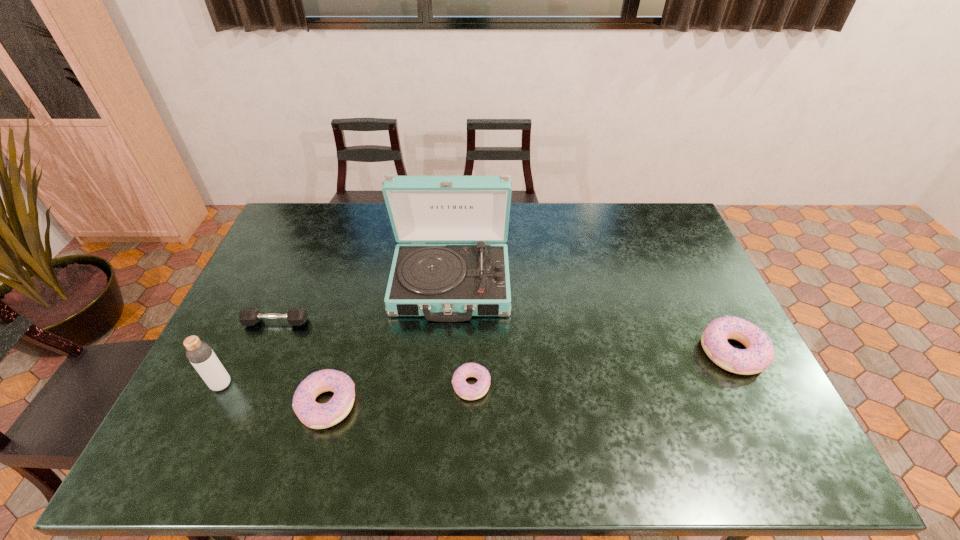
If equal spacing is the goal by inserting an additional doughnut among them, please point out a vacant space for this new doughnut. Please provide its 2D coordinates. Your answer should be formatted as a tuple, i.e. [(x, y)], where the tuple contains the x and y coordinates of a point satisfying the conditions above.

[(606, 368)]